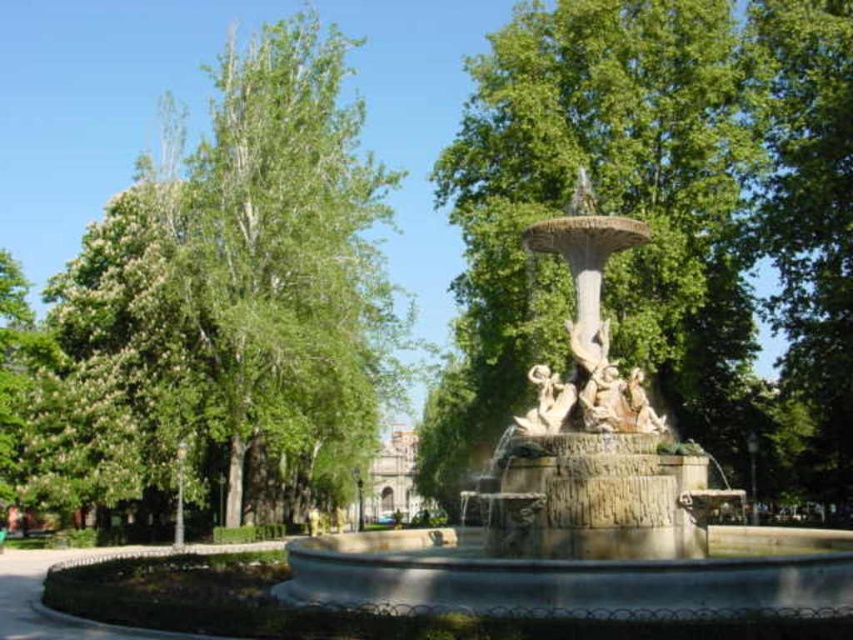
Question: Does green leafy tree at left have a lesser width compared to carved stone figures at center?

Choices:
 (A) no
 (B) yes

Answer: (A)

Question: Which point is closer to the camera?

Choices:
 (A) stone fountain at center
 (B) stone statue at center
 (C) carved stone figures at center

Answer: (A)

Question: Which object appears closest to the camera in this image?

Choices:
 (A) white marble statue at center
 (B) green leafy tree at center
 (C) stone statue at center
 (D) green leafy tree at left

Answer: (C)

Question: Does green leafy tree at left appear on the left side of green leafy tree at center?

Choices:
 (A) no
 (B) yes

Answer: (B)

Question: Does stone fountain at center have a greater width compared to stone statue at center?

Choices:
 (A) yes
 (B) no

Answer: (A)

Question: Estimate the real-world distances between objects in this image. Which object is closer to the stone statue at center?

Choices:
 (A) white marble statue at center
 (B) green leafy tree at center
 (C) green leafy tree at left
 (D) carved stone figures at center

Answer: (D)